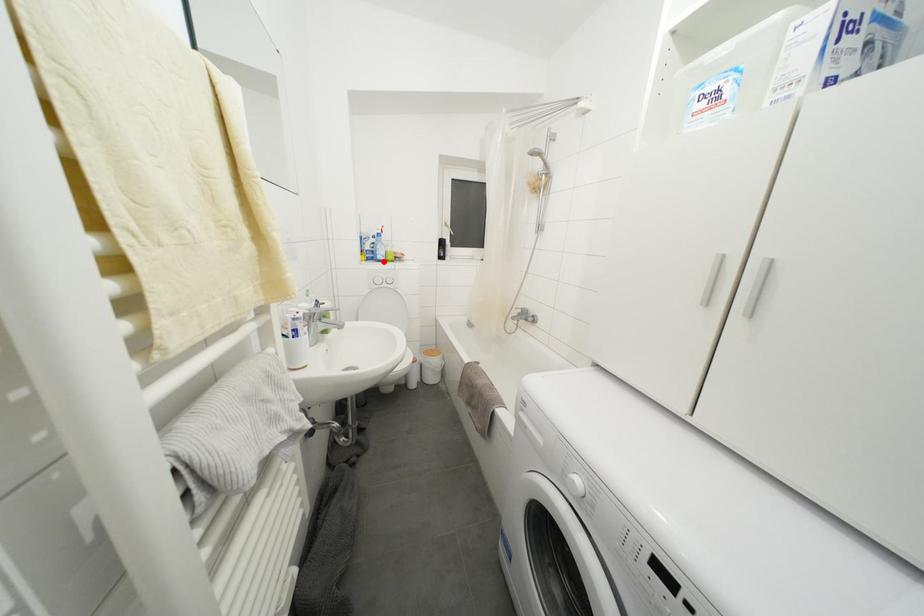
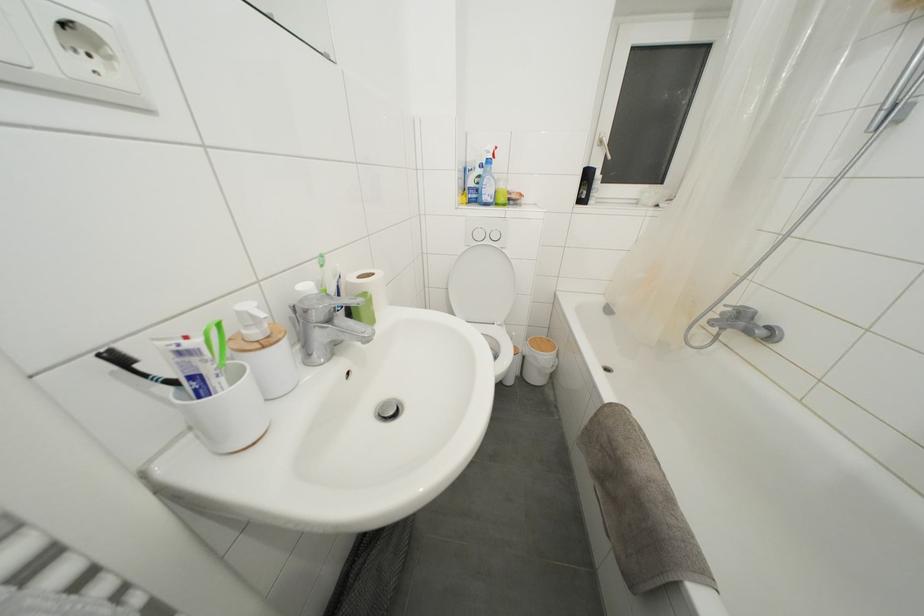
Find the pixel in the second image that matches the highlighted location in the first image.

(490, 203)